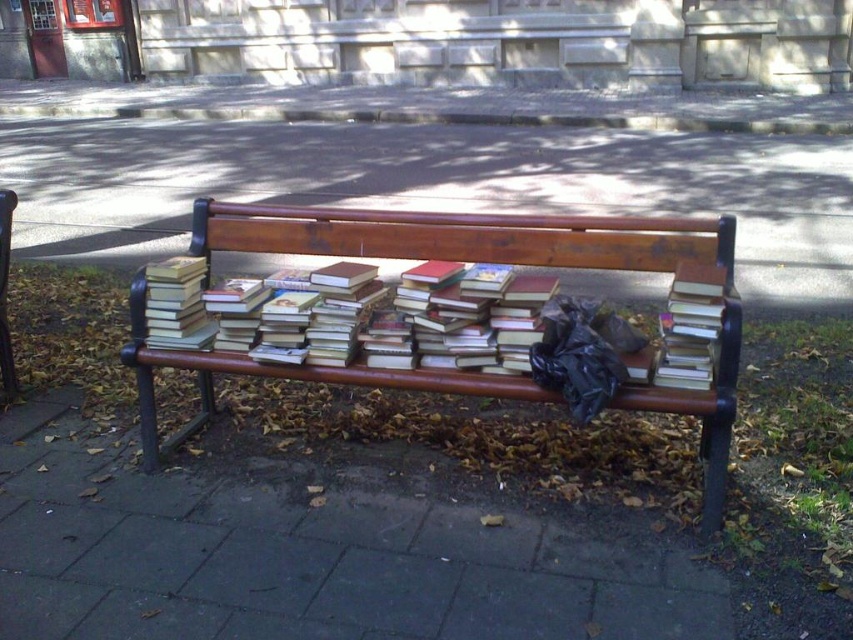
Question: Which of these objects is positioned farthest from the brown wooden bench at center?

Choices:
 (A) hardcover books at center
 (B) hardcover book at center

Answer: (A)

Question: Does wooden bench at center have a smaller size compared to hardcover books at center?

Choices:
 (A) yes
 (B) no

Answer: (B)

Question: Which object is positioned farthest from the hardcover books at center?

Choices:
 (A) wooden bench at center
 (B) brown wooden bench at center

Answer: (B)

Question: Is brown wooden bench at center below hardcover books at center?

Choices:
 (A) no
 (B) yes

Answer: (A)

Question: Which of the following is the farthest from the observer?

Choices:
 (A) (357, 333)
 (B) (234, 372)
 (C) (675, 141)

Answer: (C)

Question: Does brown wooden bench at center come behind hardcover books at center?

Choices:
 (A) yes
 (B) no

Answer: (A)